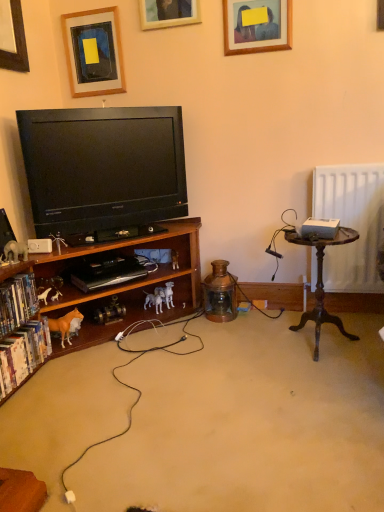
You are a GUI agent. You are given a task and a screenshot of the screen. Output one action in this format:
    pyautogui.click(x=<x>, y=<y>)
    Task: Click on the unoccupied region to the right of wooden vintage table at right
    The height and width of the screenshot is (512, 384).
    Given the screenshot: What is the action you would take?
    pyautogui.click(x=360, y=334)